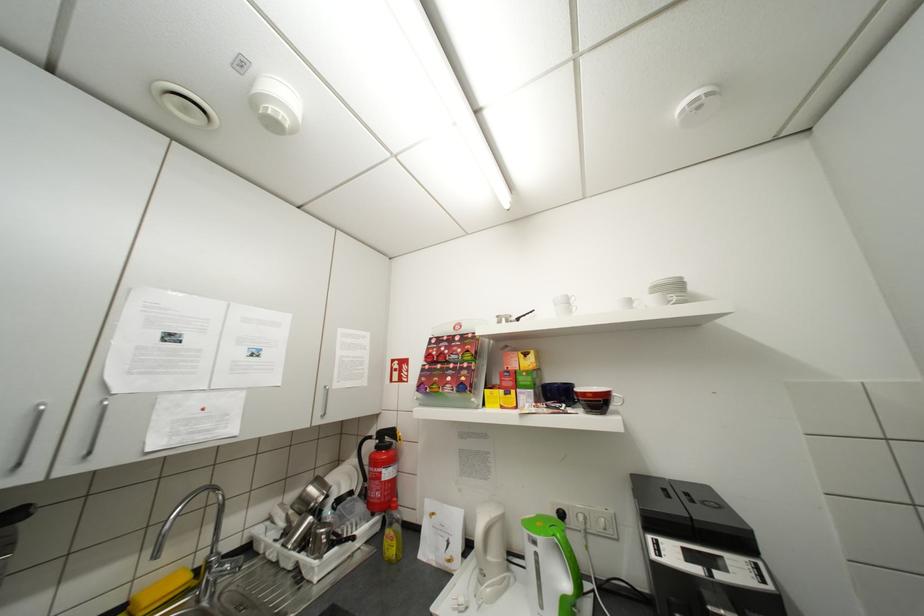
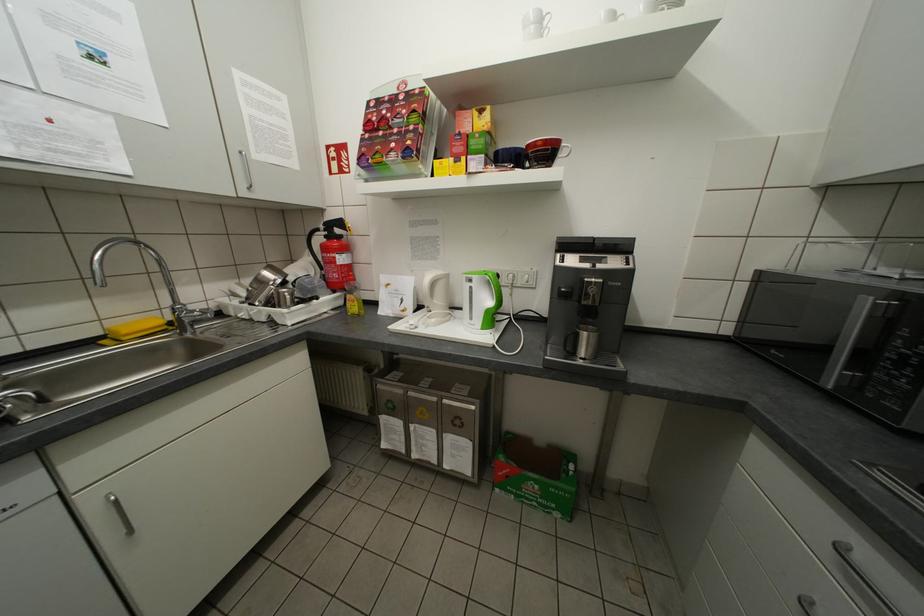
Locate, in the second image, the point that corresponds to (x=215, y=562) in the first image.

(181, 309)